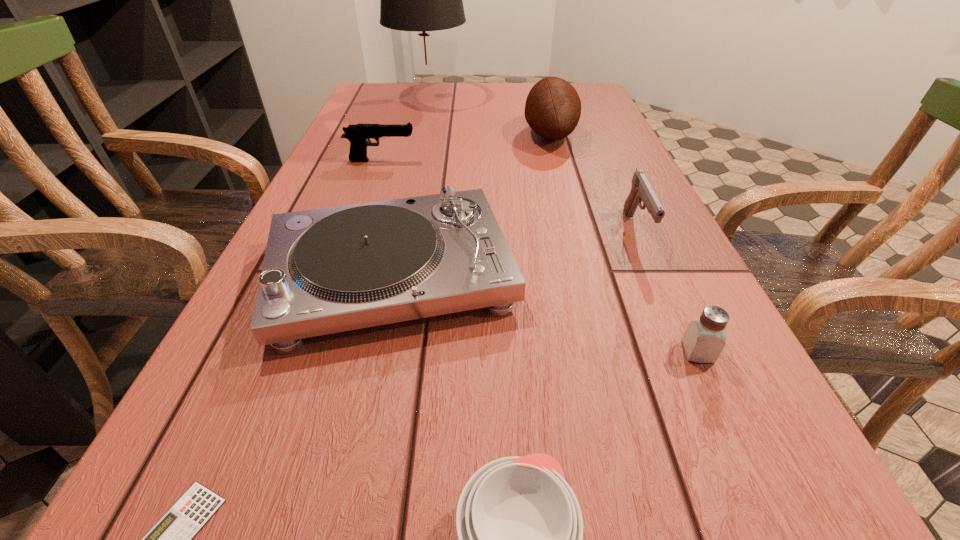
Where is `object that is the closest to the record player`? Image resolution: width=960 pixels, height=540 pixels. object that is the closest to the record player is located at coordinates (520, 530).

You are a GUI agent. You are given a task and a screenshot of the screen. Output one action in this format:
    pyautogui.click(x=<x>, y=<y>)
    Task: Click on the object that is the fourth closest one to the football
    This screenshot has height=540, width=960.
    Given the screenshot: What is the action you would take?
    pyautogui.click(x=358, y=134)

This screenshot has width=960, height=540. What are the coordinates of `vacant position in the image that satisfies the following two spatial constraints: 1. on the back side of the sixth tallest object; 2. on the laces of the seventh shortest object` in the screenshot? It's located at (598, 135).

At what (x,y) coordinates should I click in order to perform the action: click on free point that satisfies the following two spatial constraints: 1. on the back side of the record player; 2. on the front-facing side of the farther pistol. Please return your answer as a coordinate pair (x, y). Looking at the image, I should click on (418, 160).